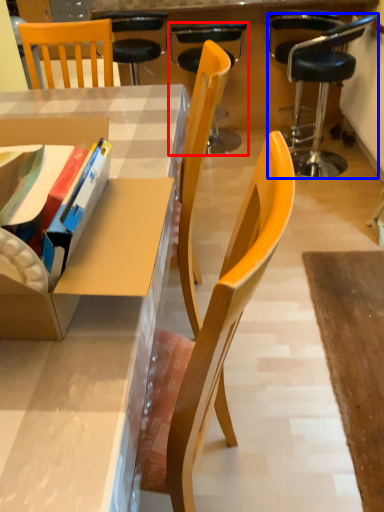
Question: Which object is closer to the camera taking this photo, chair (highlighted by a red box) or chair (highlighted by a blue box)?

Choices:
 (A) chair
 (B) chair

Answer: (B)